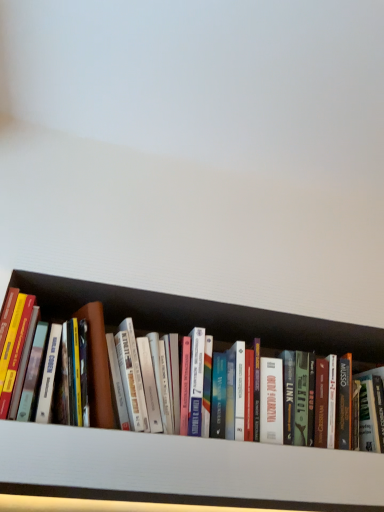
Question: From a real-world perspective, is white wood cabinet at lower center positioned under hardcover books at center based on gravity?

Choices:
 (A) yes
 (B) no

Answer: (A)

Question: Is white wood cabinet at lower center bigger than hardcover books at center?

Choices:
 (A) no
 (B) yes

Answer: (A)

Question: Is white wood cabinet at lower center at the right side of hardcover books at center?

Choices:
 (A) yes
 (B) no

Answer: (A)

Question: Is white wood cabinet at lower center to the left of hardcover books at center from the viewer's perspective?

Choices:
 (A) no
 (B) yes

Answer: (A)

Question: From the image's perspective, is white wood cabinet at lower center beneath hardcover books at center?

Choices:
 (A) no
 (B) yes

Answer: (B)

Question: Is white wood cabinet at lower center smaller than hardcover books at center?

Choices:
 (A) no
 (B) yes

Answer: (B)

Question: Is hardcover books at center surrounding white wood cabinet at lower center?

Choices:
 (A) yes
 (B) no

Answer: (B)

Question: Considering the relative sizes of hardcover books at center and white wood cabinet at lower center in the image provided, is hardcover books at center thinner than white wood cabinet at lower center?

Choices:
 (A) yes
 (B) no

Answer: (A)

Question: From a real-world perspective, is hardcover books at center positioned under white wood cabinet at lower center based on gravity?

Choices:
 (A) yes
 (B) no

Answer: (B)

Question: From the image's perspective, is hardcover books at center over white wood cabinet at lower center?

Choices:
 (A) no
 (B) yes

Answer: (B)

Question: Is hardcover books at center positioned behind white wood cabinet at lower center?

Choices:
 (A) yes
 (B) no

Answer: (A)

Question: Is hardcover books at center completely or partially outside of white wood cabinet at lower center?

Choices:
 (A) no
 (B) yes

Answer: (B)

Question: From their relative heights in the image, would you say hardcover books at center is taller or shorter than white wood cabinet at lower center?

Choices:
 (A) tall
 (B) short

Answer: (A)